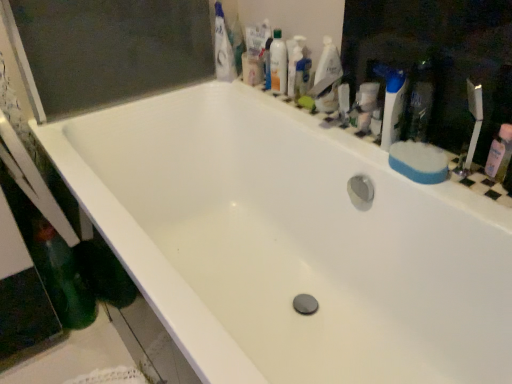
Question: Is green matte bottle at lower left located within translucent plastic mouthwash at upper right, marked as the third mouthwash in a right-to-left arrangement?

Choices:
 (A) no
 (B) yes

Answer: (A)

Question: Does translucent plastic mouthwash at upper right, positioned as the first mouthwash in top-to-bottom order, lie behind green matte bottle at lower left?

Choices:
 (A) yes
 (B) no

Answer: (A)

Question: Does translucent plastic mouthwash at upper right, the 1th mouthwash positioned from the left, turn towards green matte bottle at lower left?

Choices:
 (A) yes
 (B) no

Answer: (A)

Question: From the image's perspective, is translucent plastic mouthwash at upper right, the 1th mouthwash positioned from the left, on top of green matte bottle at lower left?

Choices:
 (A) yes
 (B) no

Answer: (A)

Question: Can you confirm if translucent plastic mouthwash at upper right, which is the third mouthwash from bottom to top, is wider than green matte bottle at lower left?

Choices:
 (A) yes
 (B) no

Answer: (B)

Question: Is translucent plastic mouthwash at upper right, the 1th mouthwash positioned from the left, outside of green matte bottle at lower left?

Choices:
 (A) no
 (B) yes

Answer: (B)

Question: Would you say white glossy toothpaste at upper center is outside blue sponge at right?

Choices:
 (A) no
 (B) yes

Answer: (B)

Question: From a real-world perspective, is white glossy toothpaste at upper center over blue sponge at right?

Choices:
 (A) yes
 (B) no

Answer: (A)

Question: Is white glossy toothpaste at upper center facing towards blue sponge at right?

Choices:
 (A) yes
 (B) no

Answer: (B)

Question: Can you confirm if white glossy toothpaste at upper center is positioned to the left of blue sponge at right?

Choices:
 (A) no
 (B) yes

Answer: (B)

Question: Is white glossy toothpaste at upper center positioned with its back to blue sponge at right?

Choices:
 (A) no
 (B) yes

Answer: (A)

Question: Is the depth of white glossy toothpaste at upper center less than that of blue sponge at right?

Choices:
 (A) yes
 (B) no

Answer: (B)

Question: Is pink plastic mouthwash at right, which ranks as the 3th mouthwash in left-to-right order, with translucent plastic mouthwash at upper right, arranged as the 3th mouthwash when viewed from the front?

Choices:
 (A) no
 (B) yes

Answer: (A)